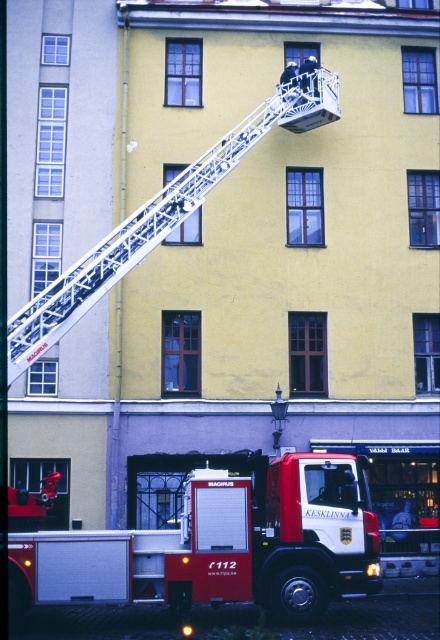
Question: Is red matte fire truck at lower left to the right of white metallic ladder at upper center from the viewer's perspective?

Choices:
 (A) no
 (B) yes

Answer: (B)

Question: Is red matte fire truck at lower left positioned before white metallic ladder at upper center?

Choices:
 (A) no
 (B) yes

Answer: (A)

Question: Does red matte fire truck at lower left lie behind white metallic ladder at upper center?

Choices:
 (A) yes
 (B) no

Answer: (A)

Question: Which point is farther to the camera?

Choices:
 (A) white metallic ladder at upper center
 (B) red matte fire truck at lower left

Answer: (B)

Question: Which point is farther to the camera?

Choices:
 (A) (102, 291)
 (B) (186, 554)

Answer: (A)